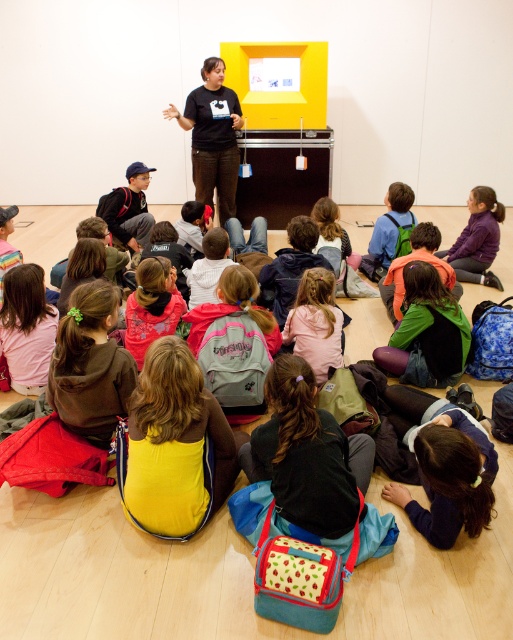
Which is more to the left, pink fabric backpack at center or purple fleece jacket at lower right?

Positioned to the left is pink fabric backpack at center.

Can you confirm if pink fabric backpack at center is positioned to the right of purple fleece jacket at lower right?

Incorrect, pink fabric backpack at center is not on the right side of purple fleece jacket at lower right.

You are a GUI agent. You are given a task and a screenshot of the screen. Output one action in this format:
    pyautogui.click(x=<x>, y=<y>)
    Task: Click on the pink fabric backpack at center
    The image size is (513, 640).
    Given the screenshot: What is the action you would take?
    pyautogui.click(x=315, y=323)

Measure the distance between point (191, 161) and camera.

5.38 meters

Is point (210, 170) positioned in front of point (332, 330)?

No, it is not.

In order to click on black matte shirt at center in this screenshot , I will do `click(212, 136)`.

Is black matte shirt at center behind purple fleece jacket at lower right?

Yes, it is behind purple fleece jacket at lower right.

Where is `black matte shirt at center`? The height and width of the screenshot is (640, 513). black matte shirt at center is located at coordinates tap(212, 136).

Describe the element at coordinates (212, 136) in the screenshot. The height and width of the screenshot is (640, 513). I see `black matte shirt at center` at that location.

Where is `black matte shirt at center`? This screenshot has height=640, width=513. black matte shirt at center is located at coordinates (212, 136).